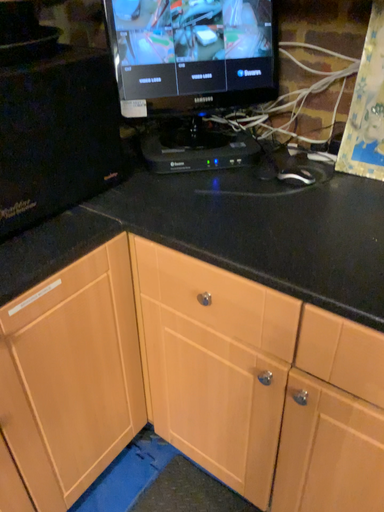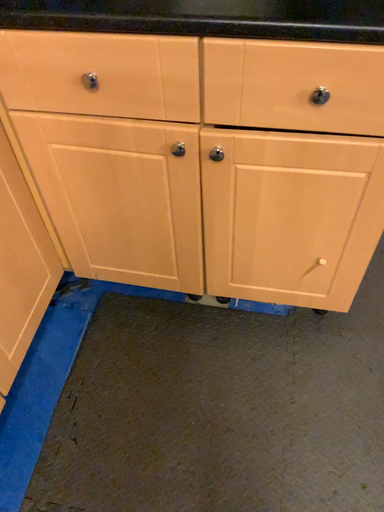
Question: How did the camera likely rotate when shooting the video?

Choices:
 (A) rotated left
 (B) rotated right

Answer: (B)